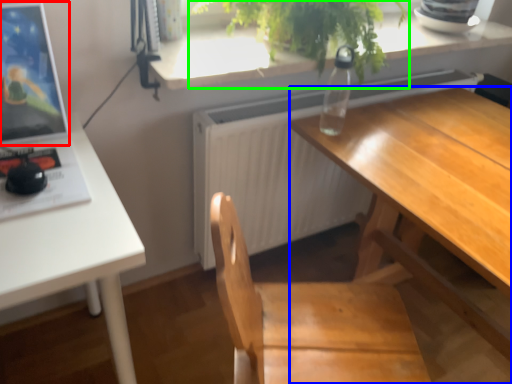
Question: Which is farther away from computer monitor (highlighted by a red box)? desk (highlighted by a blue box) or houseplant (highlighted by a green box)?

Choices:
 (A) desk
 (B) houseplant

Answer: (A)